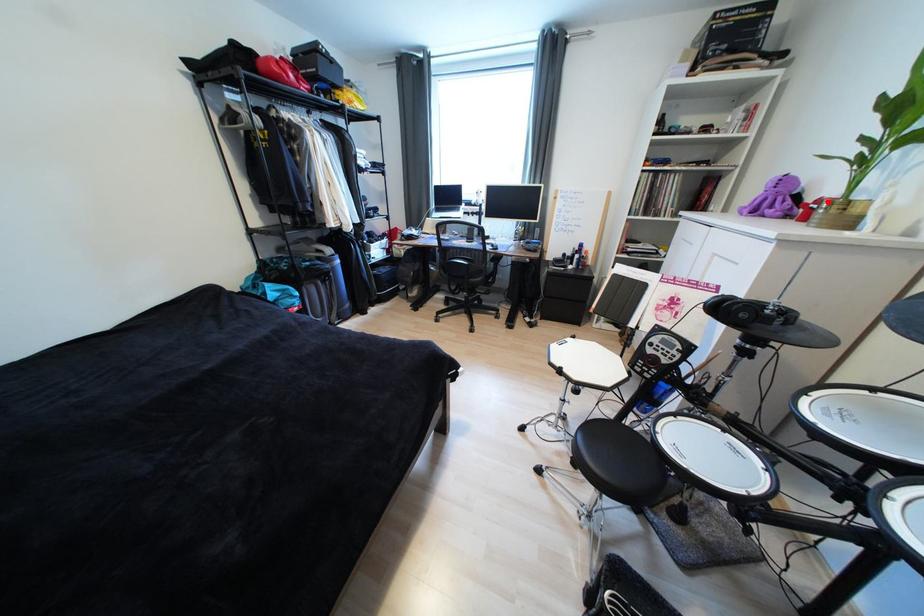
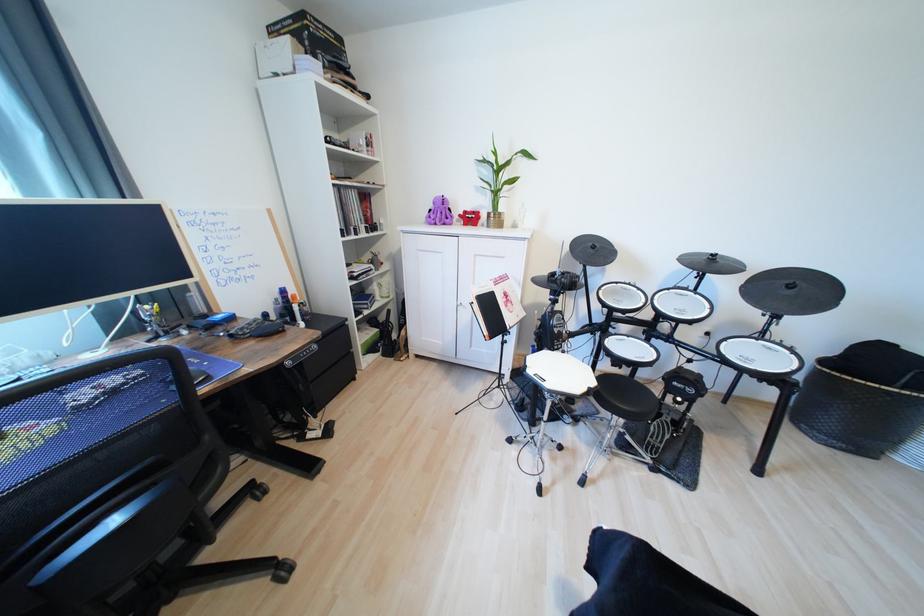
In the second image, find the point that corresponds to the highlighted location in the first image.

(472, 214)